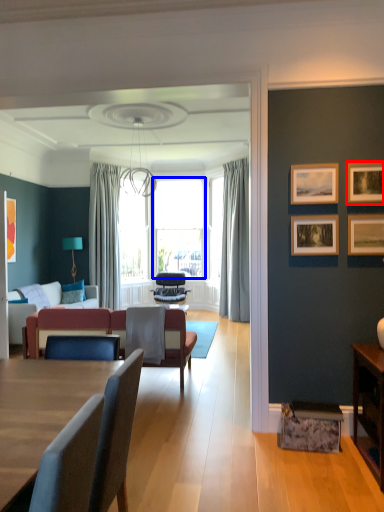
Question: Which object is further to the camera taking this photo, picture frame (highlighted by a red box) or window screen (highlighted by a blue box)?

Choices:
 (A) picture frame
 (B) window screen

Answer: (B)